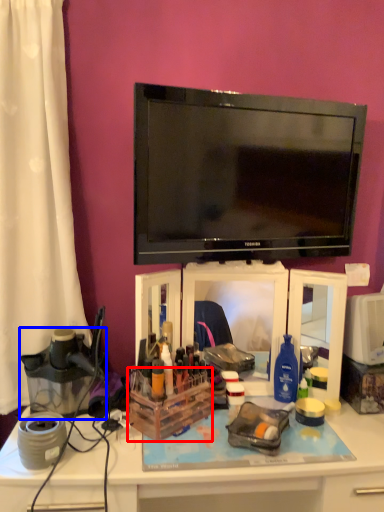
Question: Which object appears closest to the camera in this image, storage box (highlighted by a red box) or appliance (highlighted by a blue box)?

Choices:
 (A) storage box
 (B) appliance

Answer: (B)